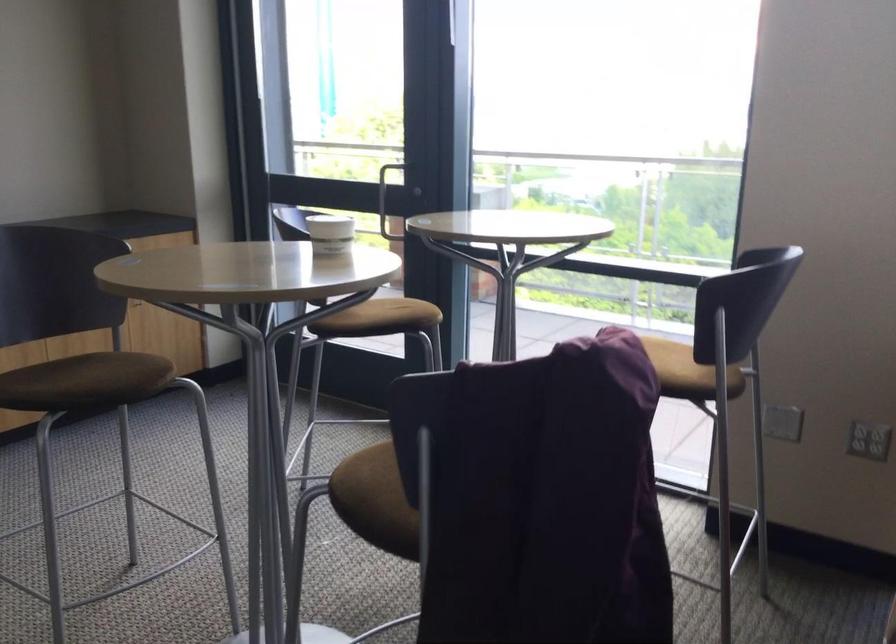
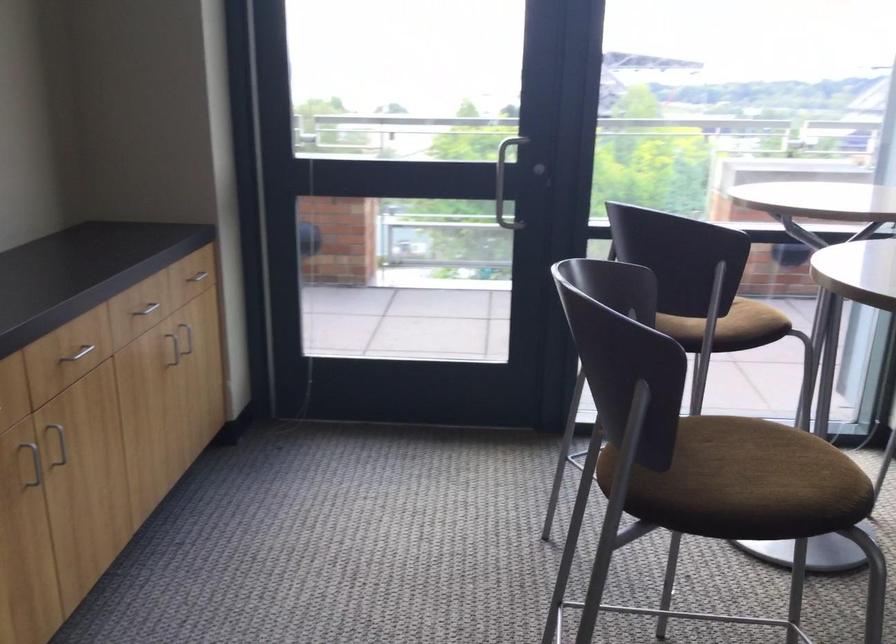
Locate, in the second image, the point that corresponds to point (85, 375) in the first image.

(739, 482)